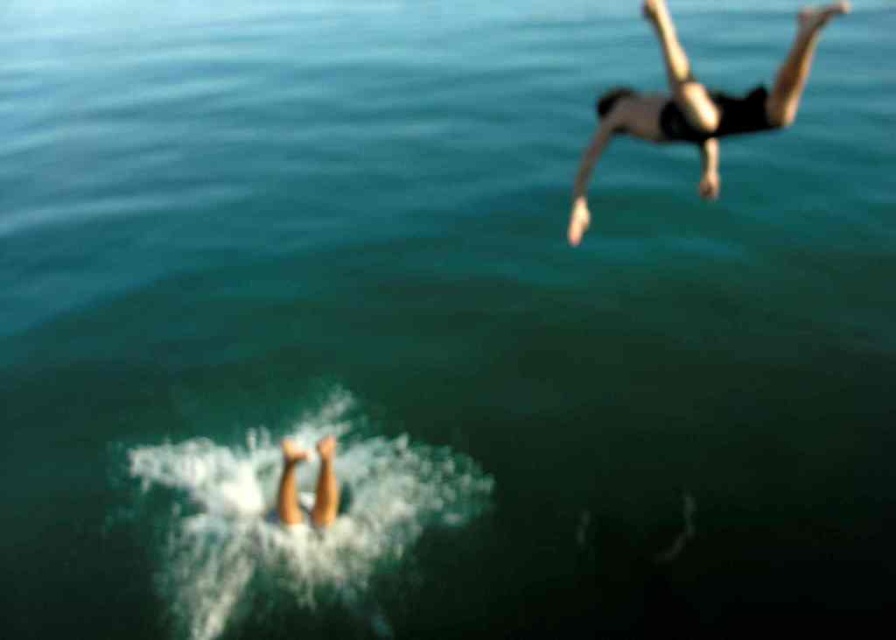
You are a photographer trying to capture the diver at point (677, 72) and the splash at point (289, 465). Which one should you focus on first to ensure both are in sharp focus?

You should focus on the diver at point (677, 72) first because it is closer to the camera than the splash at point (289, 465). This ensures the diver is in focus, and the splash will also be sharp since it is further away but still within the depth of field.

You are a lifeguard observing the scene from the beach. You notice the black matte diver at upper right and the skinny white legs at lower center. Which of these two is closer to the shore?

The skinny white legs at lower center is behind the black matte diver at upper right, so the black matte diver at upper right is closer to the shore.

You are a lifeguard observing the scene. There is a point marked at coordinates (696,104). What object or person is located at this point?

The point (696,104) marks the black matte diver at upper right.